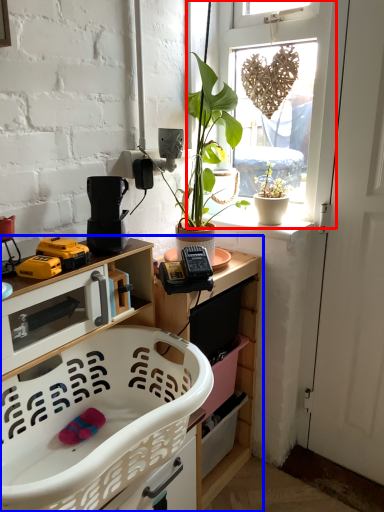
Question: Which point is closer to the camera, window (highlighted by a red box) or cabinetry (highlighted by a blue box)?

Choices:
 (A) window
 (B) cabinetry

Answer: (B)